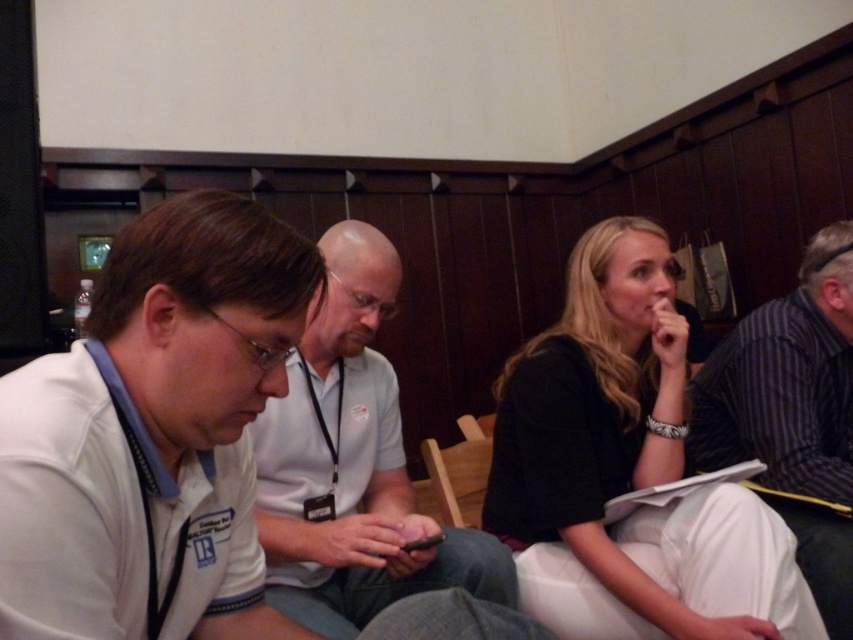
You are standing in the room and want to hand a document to both the black matte jacket at upper right and the white matte shirt at center. Which person should you approach first to ensure you can reach them without moving around the other?

You should approach the black matte jacket at upper right first because the white matte shirt at center is behind the black matte jacket at upper right, so reaching the black one first avoids needing to move around the white one.

In the conference room scene, there are two people wearing a black matte jacket at upper right and a white matte shirt at center. From the perspective of someone sitting at the head of the table, which of these two items is positioned to the left?

The white matte shirt at center is to the left of the black matte jacket at upper right from the perspective of someone sitting at the head of the table.

You are organizing a charity event and need to decide which clothing item to display first. Based on their sizes, which item should you choose between the black matte jacket at upper right and the white matte shirt at center?

The black matte jacket at upper right has a larger size compared to the white matte shirt at center, so you should choose the black matte jacket at upper right to display first since it is bigger.